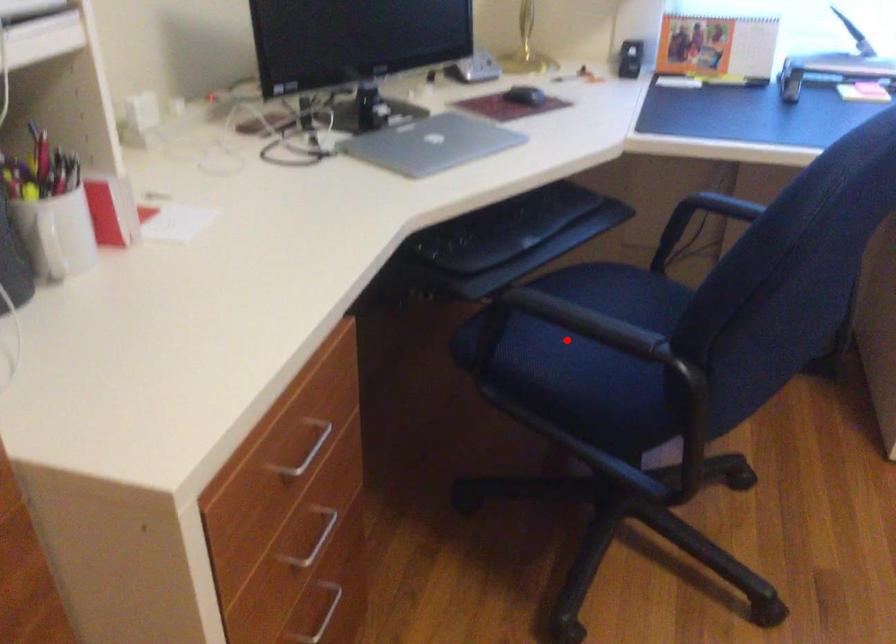
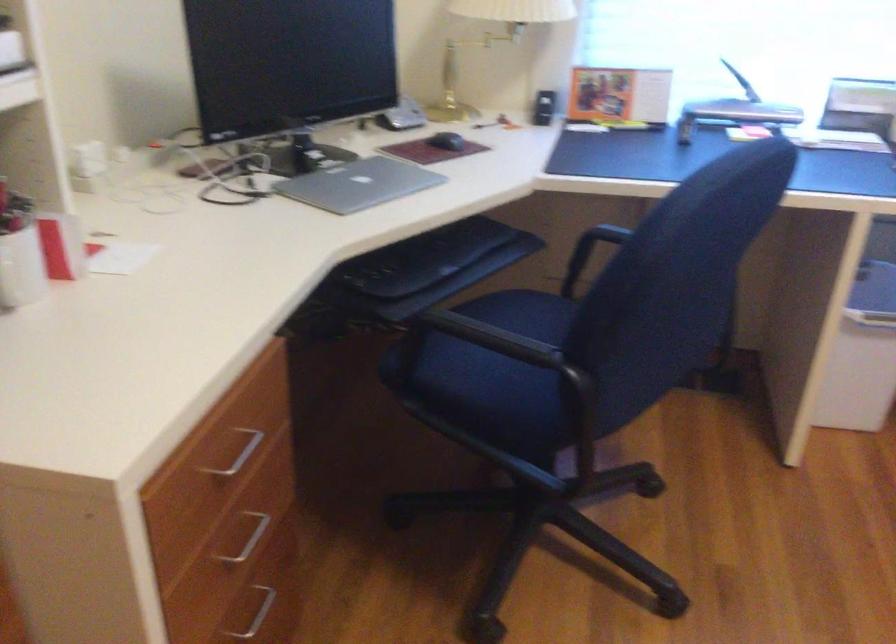
Locate, in the second image, the point that corresponds to the highlighted location in the first image.

(484, 359)